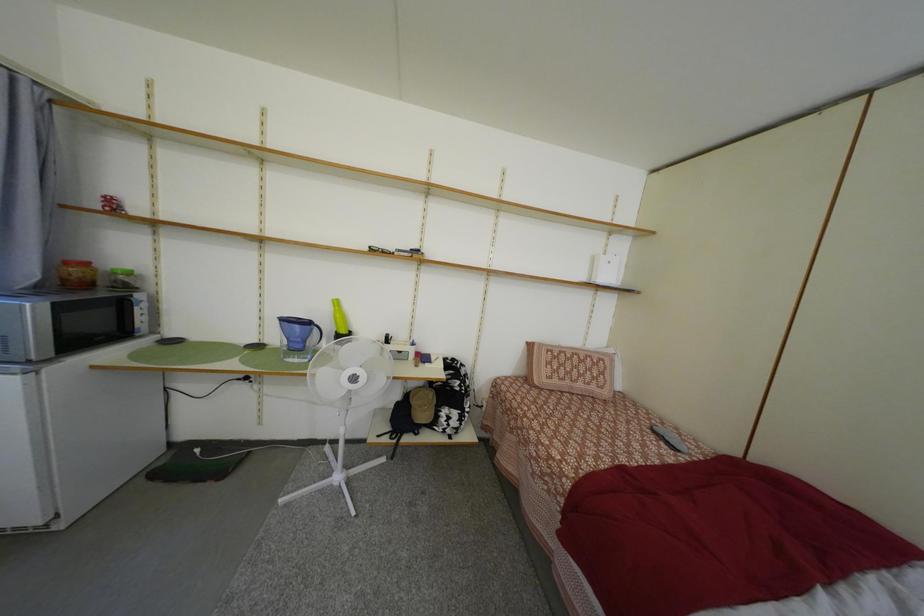
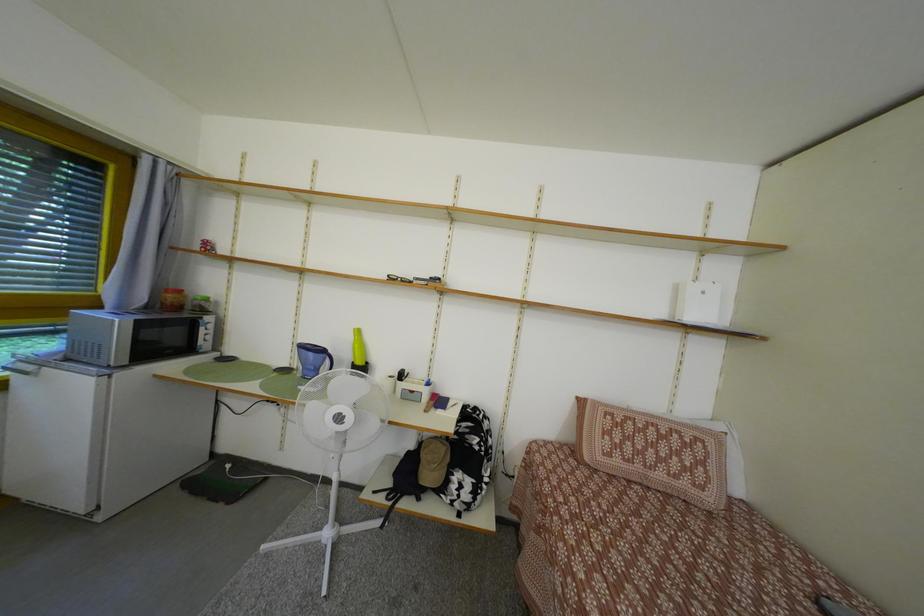
Question: The camera is either moving clockwise (left) or counter-clockwise (right) around the object. The first image is from the beginning of the video and the second image is from the end. Is the camera moving left or right when shooting the video?

Choices:
 (A) Left
 (B) Right

Answer: (B)